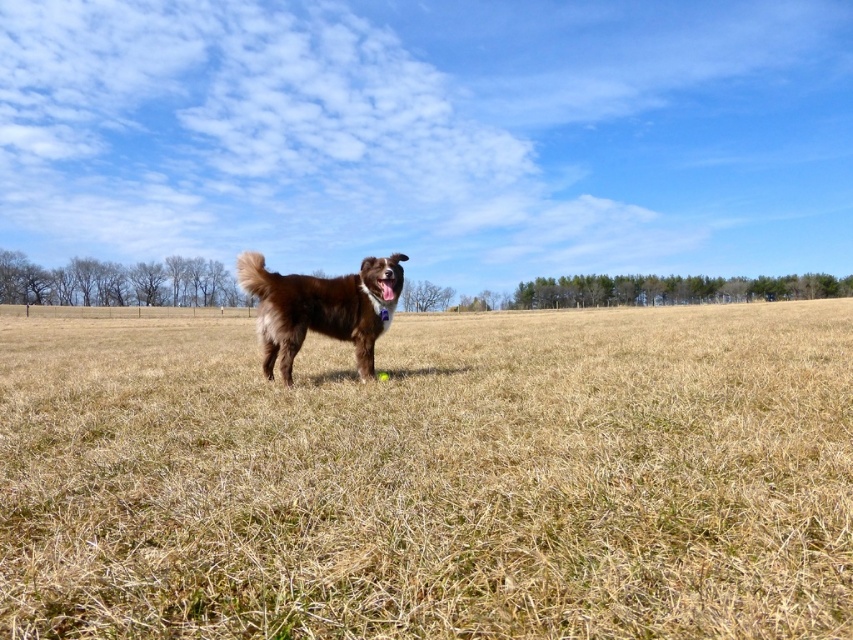
Does dry grass at center come in front of brown furry dog at center?

Yes, it is.

This screenshot has width=853, height=640. I want to click on dry grass at center, so click(x=432, y=477).

The image size is (853, 640). What do you see at coordinates (432, 477) in the screenshot?
I see `dry grass at center` at bounding box center [432, 477].

Find the location of a particular element. The image size is (853, 640). dry grass at center is located at coordinates (432, 477).